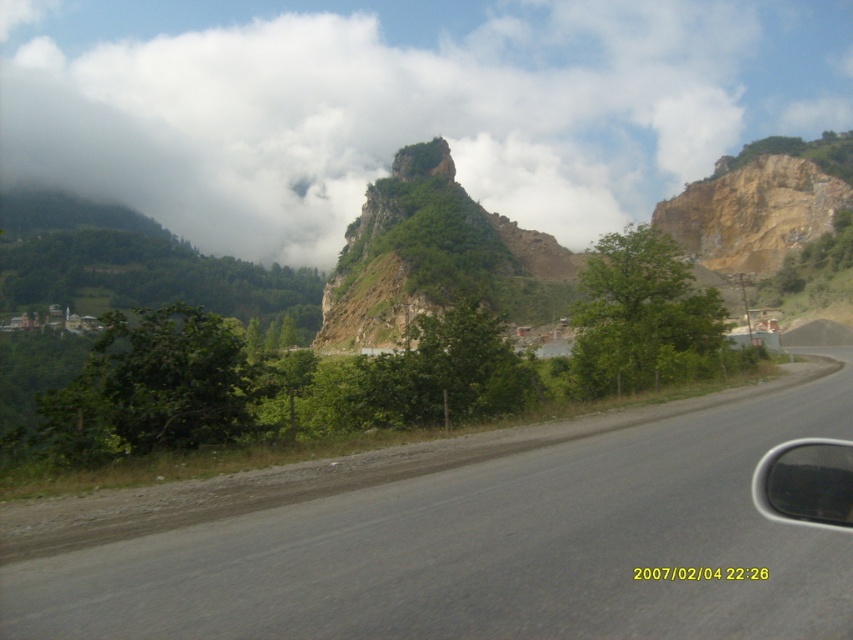
You are driving a car with a 1.8 meter wide trunk. You see a white fluffy cloud at upper center in the distance. Can your trunk fit the cloud?

The white fluffy cloud at upper center is 238.86 meters away, so it is not possible to fit the cloud into the trunk since it is too far away and clouds are not physical objects that can be placed in a trunk.

You are a passenger in a car driving along this road. You look out the transparent glass car window at right and see the white fluffy cloud at upper center. Is the cloud above or below the window?

The white fluffy cloud at upper center is above the transparent glass car window at right.

You are driving a car with a 2.5 meter wide trailer attached to the back. You need to make a sharp turn to the right. Considering the gray asphalt road at center is 4.70 meters from you, will the trailer fit safely within the road during the turn?

The gray asphalt road at center is 4.70 meters from you. Since the trailer is 2.5 meters wide, it should fit within the road width during the turn, provided the driver adjusts the turning angle appropriately. However, actual safety depends on the road curvature and other factors not specified here.